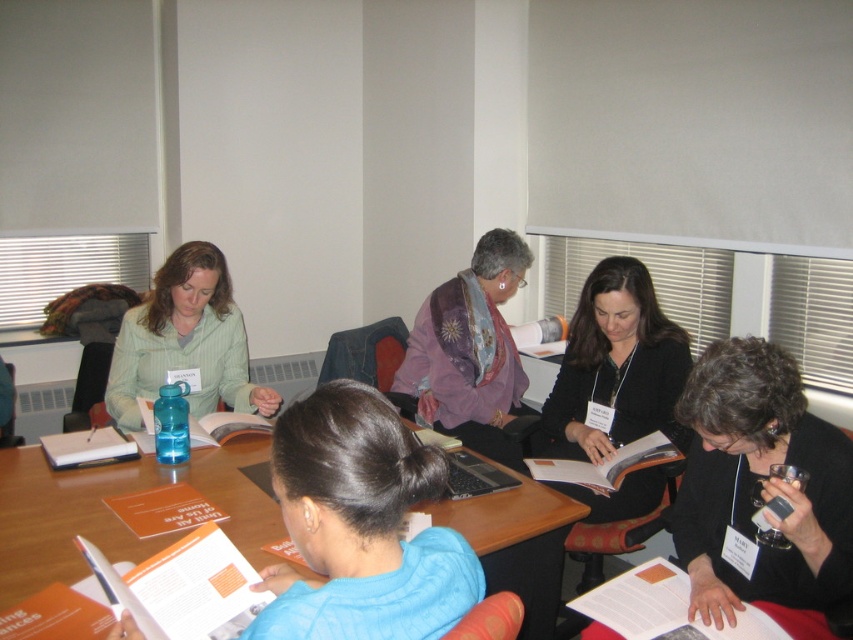
Does wooden table at center have a lesser width compared to purple silk scarf at center?

Incorrect, wooden table at center's width is not less than purple silk scarf at center's.

Where is `wooden table at center`? This screenshot has width=853, height=640. wooden table at center is located at coordinates (113, 515).

What are the coordinates of `wooden table at center` in the screenshot? It's located at (113, 515).

Can you confirm if black matte jacket at center is bigger than purple silk scarf at center?

Yes.

Describe the element at coordinates (614, 369) in the screenshot. The height and width of the screenshot is (640, 853). I see `black matte jacket at center` at that location.

The image size is (853, 640). What are the coordinates of `black matte jacket at center` in the screenshot? It's located at (614, 369).

Who is shorter, wooden table at center or matte green shirt at upper left?

Standing shorter between the two is wooden table at center.

Where is `wooden table at center`? The width and height of the screenshot is (853, 640). wooden table at center is located at coordinates (113, 515).